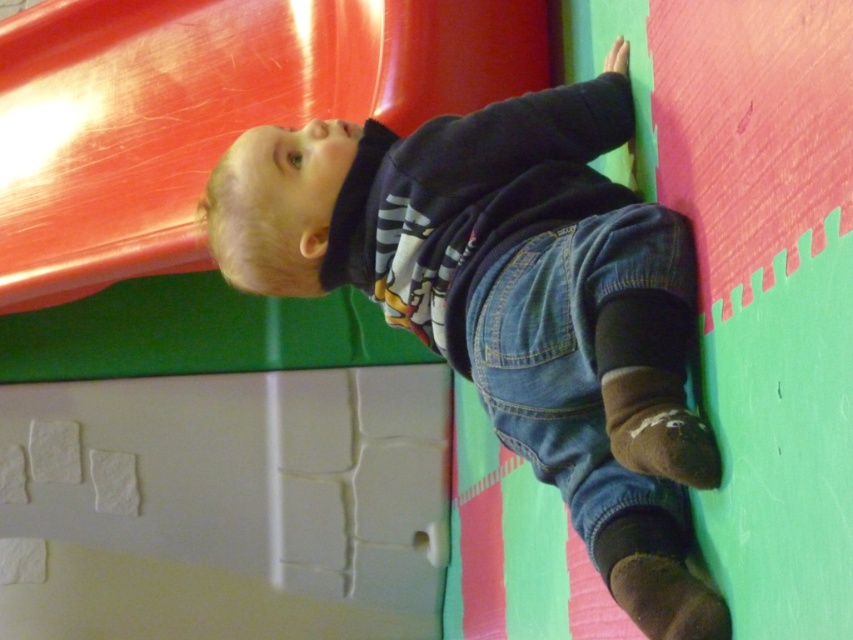
Between denim overalls at center and shiny plastic slide at upper left, which one has more height?

With more height is shiny plastic slide at upper left.

Is denim overalls at center shorter than shiny plastic slide at upper left?

Correct, denim overalls at center is not as tall as shiny plastic slide at upper left.

Locate an element on the screen. Image resolution: width=853 pixels, height=640 pixels. denim overalls at center is located at coordinates (512, 300).

Does shiny plastic slide at upper left have a smaller size compared to denim at lower right?

No, shiny plastic slide at upper left is not smaller than denim at lower right.

Who is lower down, shiny plastic slide at upper left or denim at lower right?

denim at lower right is below.

Does point (82, 61) lie behind point (567, 408)?

Yes.

You are a GUI agent. You are given a task and a screenshot of the screen. Output one action in this format:
    pyautogui.click(x=<x>, y=<y>)
    Task: Click on the shiny plastic slide at upper left
    The image size is (853, 640).
    Given the screenshot: What is the action you would take?
    pyautogui.click(x=207, y=109)

Can you confirm if denim overalls at center is thinner than denim at lower right?

Incorrect, denim overalls at center's width is not less than denim at lower right's.

Does point (502, 294) lie in front of point (624, 212)?

No, (502, 294) is behind (624, 212).

Find the location of a particular element. The height and width of the screenshot is (640, 853). denim overalls at center is located at coordinates (512, 300).